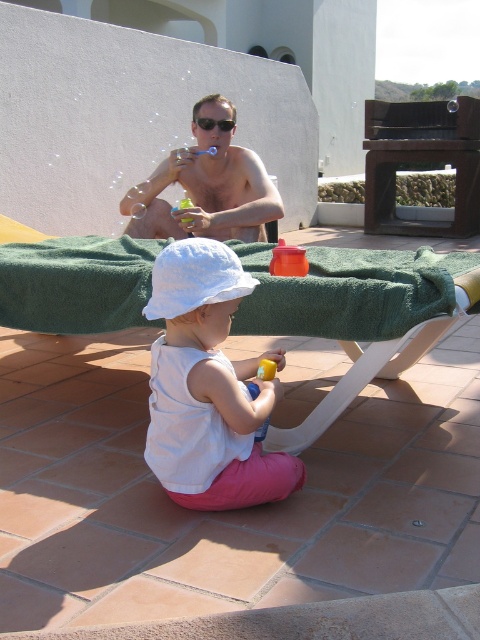
You are a poolside attendant and need to retrieve the white cotton hat at center and the matte plastic cup at upper center. The pool rules state that you must carry both items in one trip without dropping either. Your carrying basket can only hold items within a 5 feet diameter. Can you safely carry both items together in one trip?

The distance between the white cotton hat at center and the matte plastic cup at upper center is 5.22 feet. Since the basket can only hold items within a 5 feet diameter, the items are too far apart to fit within the basket. Therefore, you cannot safely carry both in one trip.

You are a photographer trying to capture a photo of both the matte plastic cup at upper center and the white plastic beach chair at center. Which object should you focus on first to ensure both are in focus?

You should focus on the matte plastic cup at upper center first because it is closer to you than the white plastic beach chair at center, so focusing on the closer object ensures both will be in focus.

You are a photographer taking a picture of the scene. You need to ensure that both the white cotton hat at center and the matte plastic cup at upper center are clearly visible in the frame. Given their sizes, which object might require you to adjust your camera angle to avoid being too small in the photo?

The white cotton hat at center is not as tall as the matte plastic cup at upper center, so the smaller white cotton hat at center might need a closer camera angle to ensure it appears large enough in the photo.